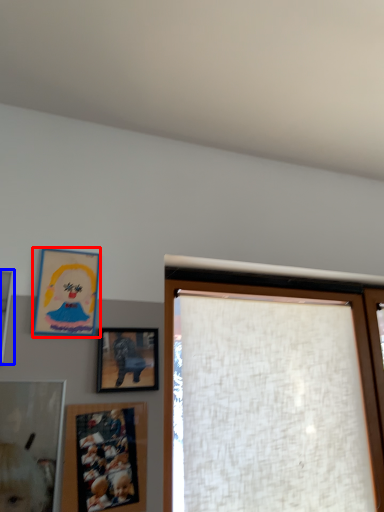
Question: Among these objects, which one is nearest to the camera, picture frame (highlighted by a red box) or picture frame (highlighted by a blue box)?

Choices:
 (A) picture frame
 (B) picture frame

Answer: (B)